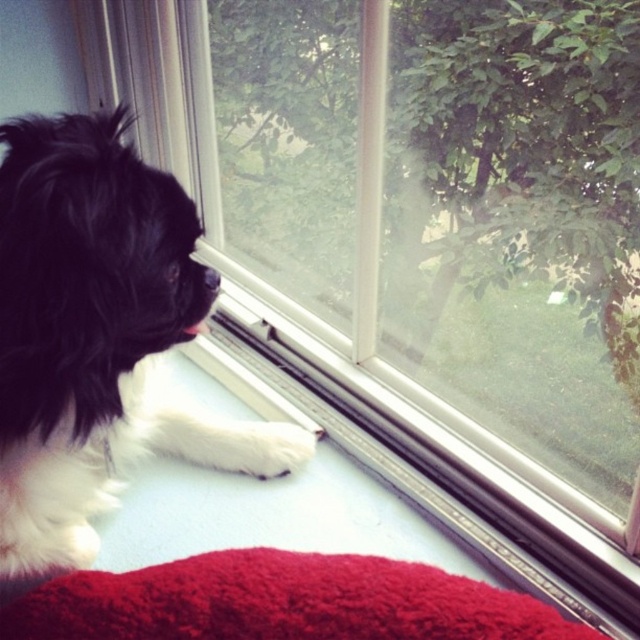
Which is above, black fluffy dog at left or fluffy red blanket at lower center?

black fluffy dog at left is above.

You are a GUI agent. You are given a task and a screenshot of the screen. Output one action in this format:
    pyautogui.click(x=<x>, y=<y>)
    Task: Click on the black fluffy dog at left
    The width and height of the screenshot is (640, 640).
    Given the screenshot: What is the action you would take?
    pyautogui.click(x=97, y=336)

Is point (186, 452) positioned behind point (428, 627)?

Yes, point (186, 452) is behind point (428, 627).

The height and width of the screenshot is (640, 640). What are the coordinates of `black fluffy dog at left` in the screenshot? It's located at (97, 336).